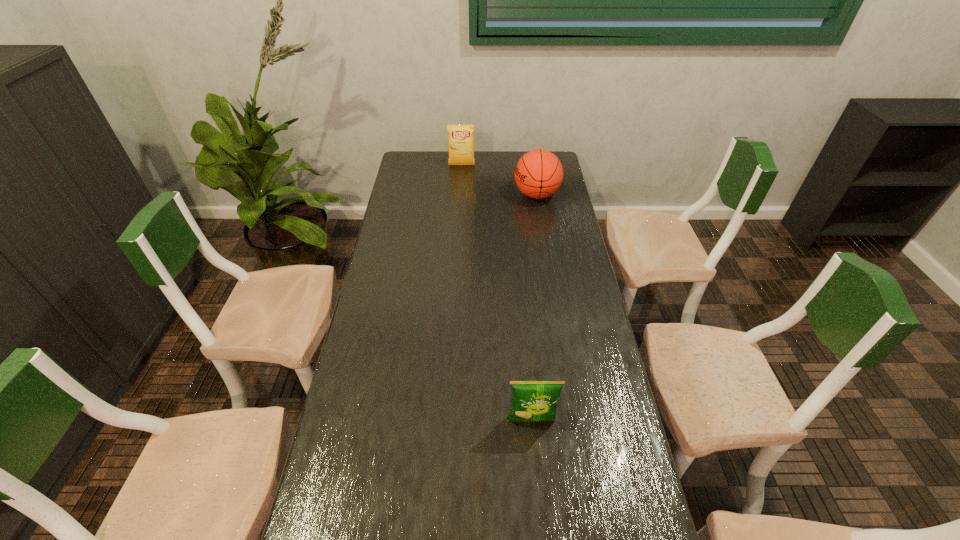
Locate an element on the screen. the farther crisp (potato chip) is located at coordinates (460, 137).

Where is `the farthest object`? The width and height of the screenshot is (960, 540). the farthest object is located at coordinates (460, 137).

Image resolution: width=960 pixels, height=540 pixels. I want to click on basketball, so click(x=538, y=174).

This screenshot has width=960, height=540. Find the location of `the nearest object`. the nearest object is located at coordinates [x=532, y=400].

Find the location of `the right crisp (potato chip)`. the right crisp (potato chip) is located at coordinates (532, 400).

Where is `free region located on the front of the farthest object with the logo`? This screenshot has height=540, width=960. free region located on the front of the farthest object with the logo is located at coordinates (459, 214).

You are a GUI agent. You are given a task and a screenshot of the screen. Output one action in this format:
    pyautogui.click(x=<x>, y=<y>)
    Task: Click on the free location located on the side with logo of the basketball
    This screenshot has height=540, width=960.
    Given the screenshot: What is the action you would take?
    pyautogui.click(x=492, y=195)

Where is `vacant point located 0.080m on the side with logo of the basketball`? The height and width of the screenshot is (540, 960). vacant point located 0.080m on the side with logo of the basketball is located at coordinates (495, 195).

Locate an element on the screen. The width and height of the screenshot is (960, 540). vacant space located 0.200m on the side with logo of the basketball is located at coordinates (469, 195).

I want to click on free space located 0.190m on the front-facing side of the nearer crisp (potato chip), so click(539, 503).